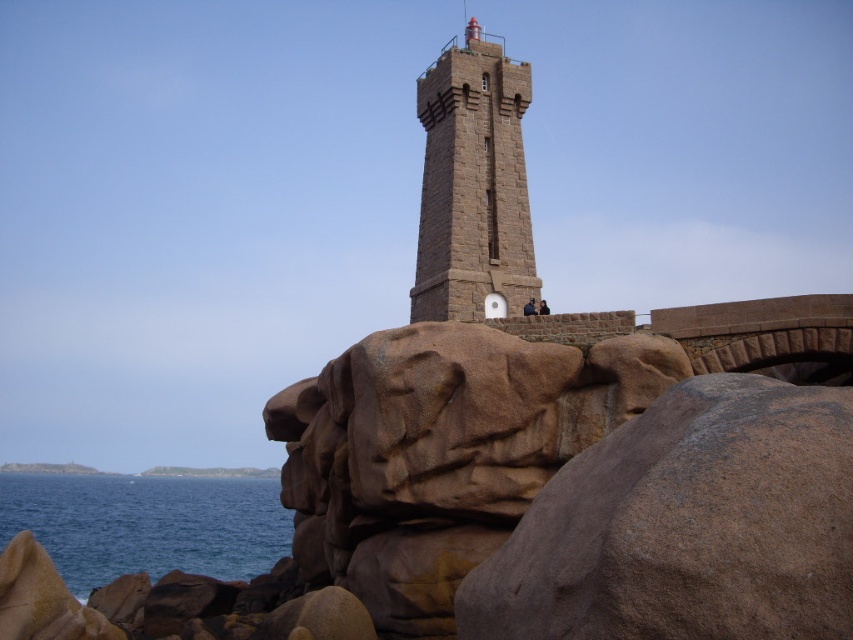
You are a seagull flying over the coastal scene. You see the brown stone tower at center and the blue water at lower left. Which one is higher in the scene?

The brown stone tower at center is positioned over the blue water at lower left, so it is higher in the scene.

You are standing at the point marked as point (473, 186) in the coastal scene. What object is exactly at your current location?

The brown stone tower at center is located at point (473, 186).